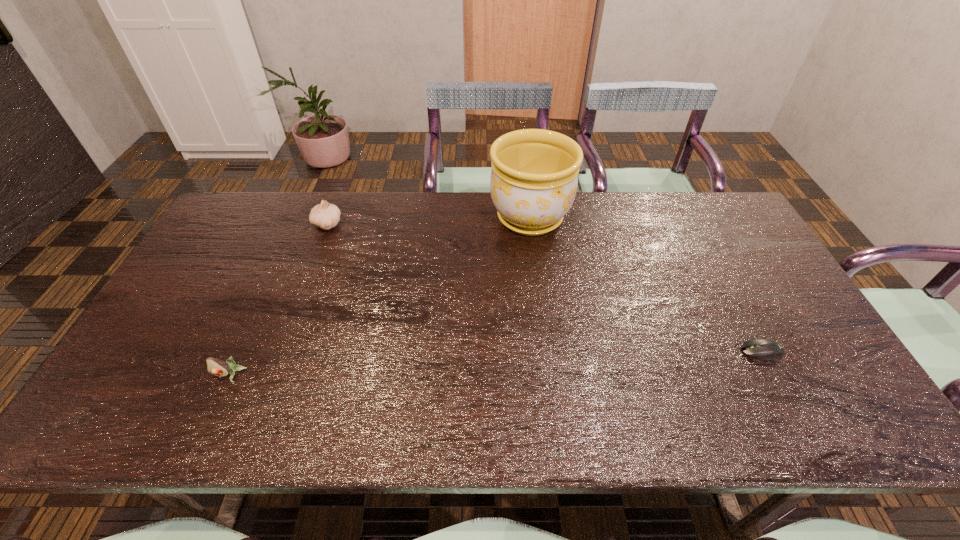
In the image, there is a desktop. Identify the location of vacant space at the near left corner. The height and width of the screenshot is (540, 960). (160, 422).

I want to click on vacant space that's between the flowerpot and the rightmost object, so click(646, 285).

Locate an element on the screen. This screenshot has width=960, height=540. empty location between the rightmost object and the tallest object is located at coordinates (646, 285).

Identify the location of free space between the rightmost object and the nearest object. Image resolution: width=960 pixels, height=540 pixels. (495, 363).

Where is `vacant area that lies between the nearest object and the garlic`? vacant area that lies between the nearest object and the garlic is located at coordinates (278, 300).

You are a GUI agent. You are given a task and a screenshot of the screen. Output one action in this format:
    pyautogui.click(x=<x>, y=<y>)
    Task: Click on the vacant space that's between the garlic and the nearest object
    This screenshot has width=960, height=540.
    Given the screenshot: What is the action you would take?
    pyautogui.click(x=278, y=300)

The width and height of the screenshot is (960, 540). Identify the location of empty space that is in between the second object from left to right and the rightmost object. (544, 288).

Locate an element on the screen. The width and height of the screenshot is (960, 540). blank region between the leftmost object and the second object from right to left is located at coordinates (380, 296).

Where is `free point between the tallest object and the computer mouse`? The height and width of the screenshot is (540, 960). free point between the tallest object and the computer mouse is located at coordinates (646, 285).

In order to click on vacant area between the third farthest object and the nearest object in this screenshot , I will do `click(495, 363)`.